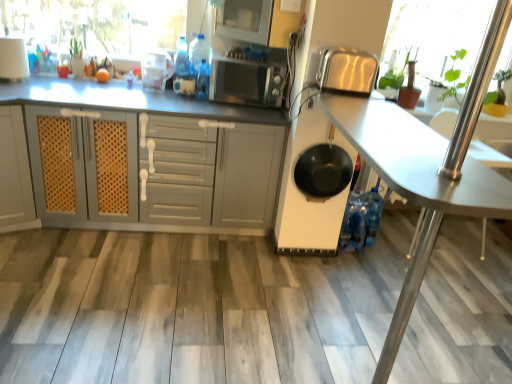
Find the location of a particular element. The width and height of the screenshot is (512, 384). vacant point to the right of metallic silver table at center is located at coordinates (443, 337).